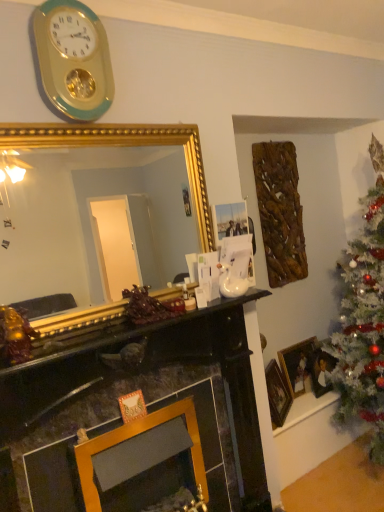
I want to click on blank space above gold/gilded mirror at center (from a real-world perspective), so click(x=88, y=120).